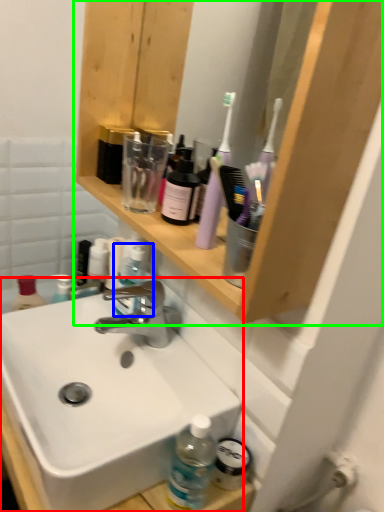
Question: Based on their relative distances, which object is farther from sink (highlighted by a red box)? Choose from bottle (highlighted by a blue box) and shelf (highlighted by a green box).

Choices:
 (A) bottle
 (B) shelf

Answer: (B)